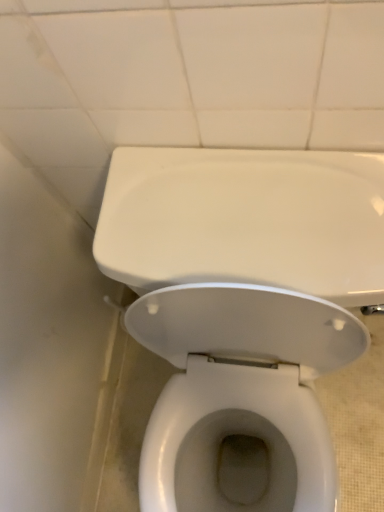
What do you see at coordinates (243, 306) in the screenshot?
I see `white glossy toilet at center` at bounding box center [243, 306].

Locate an element on the screen. white glossy toilet at center is located at coordinates (243, 306).

You are a GUI agent. You are given a task and a screenshot of the screen. Output one action in this format:
    pyautogui.click(x=<x>, y=<y>)
    Task: Click on the white glossy toilet at center
    The height and width of the screenshot is (512, 384).
    Given the screenshot: What is the action you would take?
    pyautogui.click(x=243, y=306)